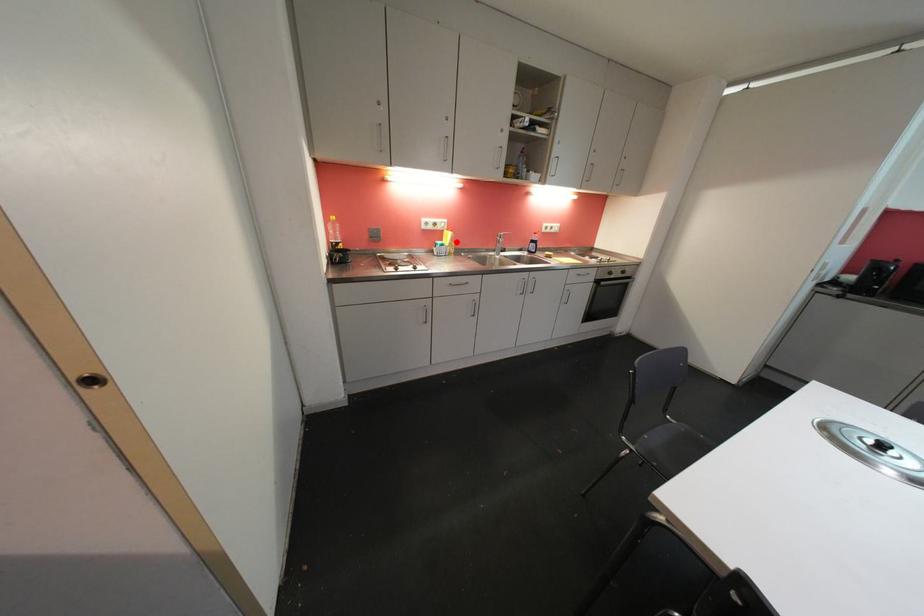
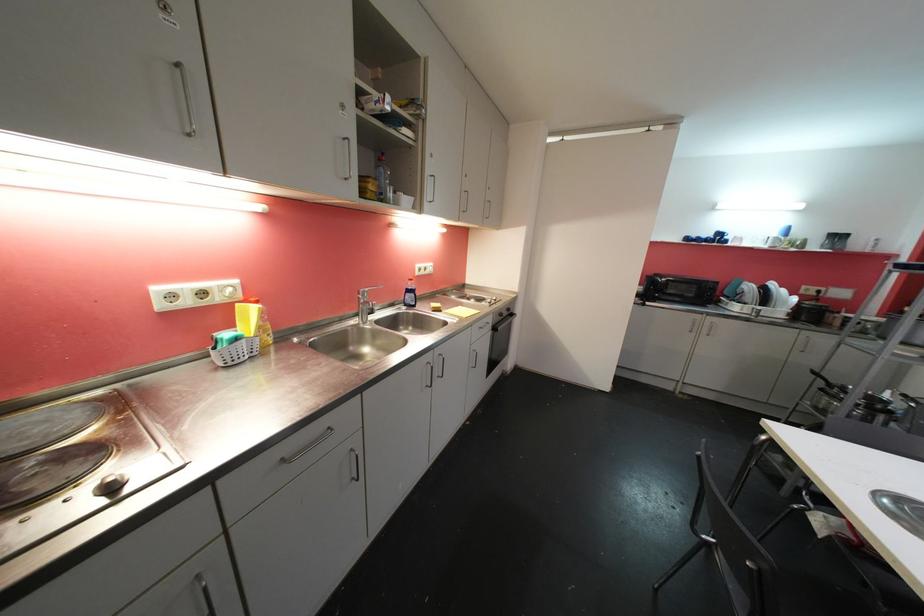
Question: I am providing you with two images of the same scene from different viewpoints. A red point is marked on the first image. At the location where the point appears in image 1, is it still visible in image 2?

Choices:
 (A) Yes
 (B) No

Answer: (A)